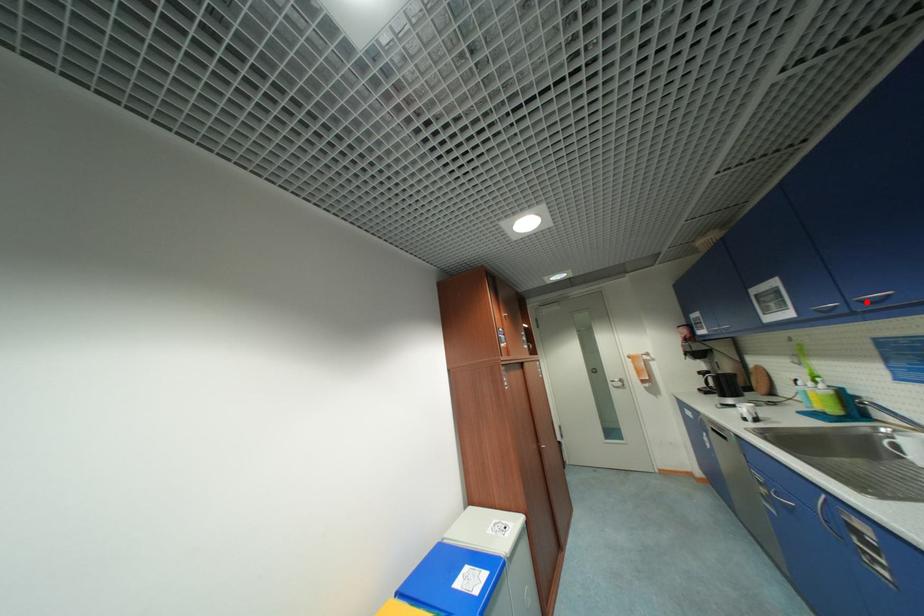
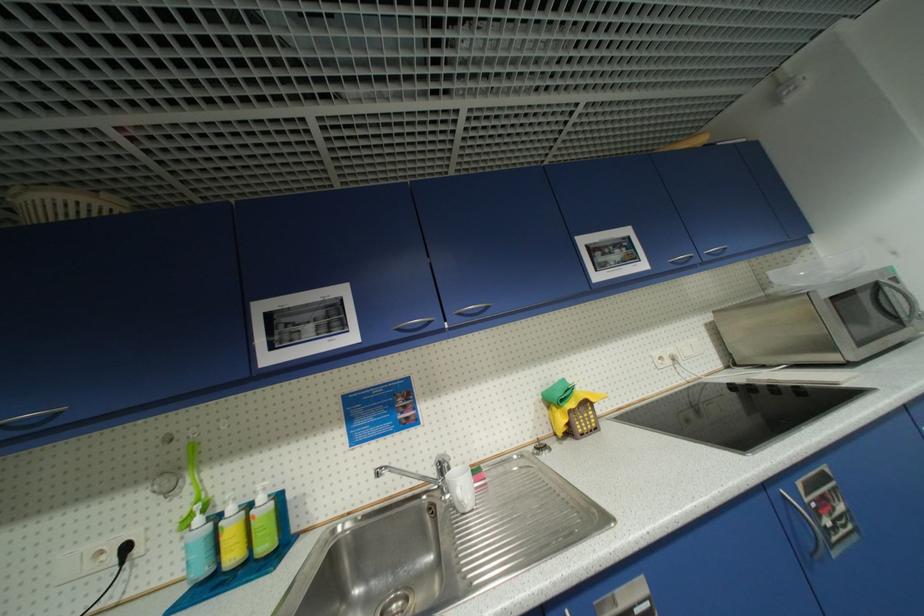
Question: I am providing you with two images of the same scene from different viewpoints. Image1 has a red point marked. In image2, the corresponding 3D location appears at what relative position? Reply with the corresponding letter.

Choices:
 (A) Closer
 (B) Farther

Answer: (B)